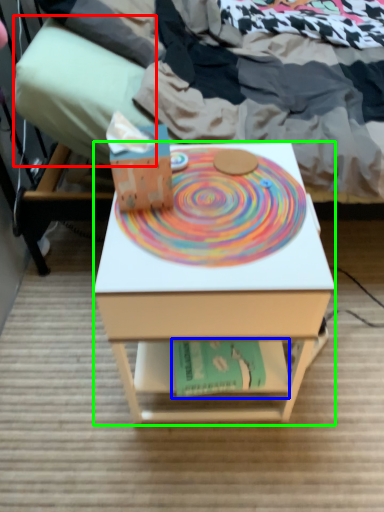
Question: Which object is positioned closest to pillow (highlighted by a red box)? Select from paperback book (highlighted by a blue box) and desk (highlighted by a green box).

Choices:
 (A) paperback book
 (B) desk

Answer: (B)